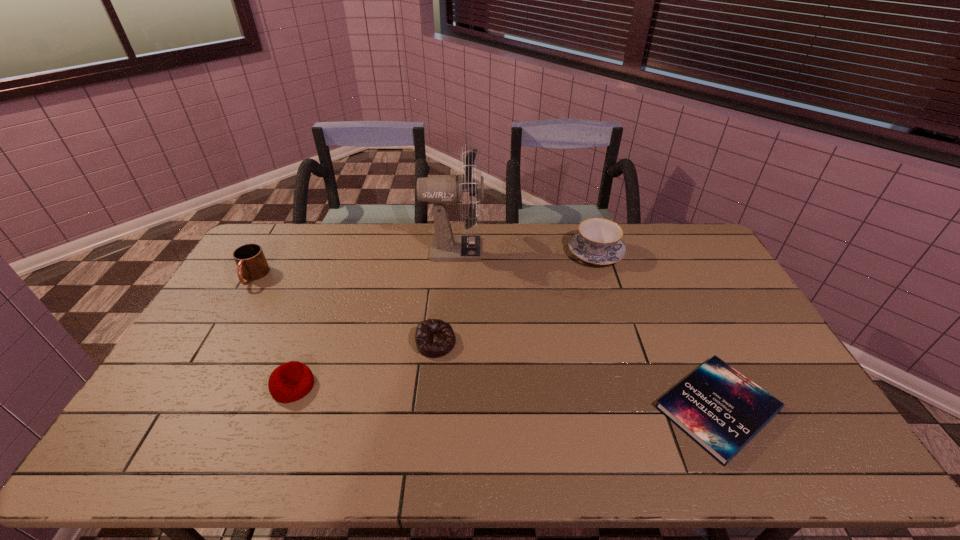
Image resolution: width=960 pixels, height=540 pixels. Find the location of `empty location between the tallest object and the leftmost object`. empty location between the tallest object and the leftmost object is located at coordinates (353, 263).

Find the location of a particular element. The height and width of the screenshot is (540, 960). free area in between the mug and the second shortest object is located at coordinates (345, 310).

You are a GUI agent. You are given a task and a screenshot of the screen. Output one action in this format:
    pyautogui.click(x=<x>, y=<y>)
    Task: Click on the free spot between the chinaware and the tallest object
    The width and height of the screenshot is (960, 540).
    Given the screenshot: What is the action you would take?
    pyautogui.click(x=525, y=251)

Locate an element on the screen. free space between the chinaware and the fifth object from right to left is located at coordinates (444, 319).

The width and height of the screenshot is (960, 540). Find the location of `free space between the fan and the fourth farthest object`. free space between the fan and the fourth farthest object is located at coordinates (444, 296).

Where is `vacant point located between the second object from left to right and the mug`? vacant point located between the second object from left to right and the mug is located at coordinates (274, 332).

Identify the location of object that is the fifth closest to the tallest object. (718, 407).

Identify which object is the fourth closest to the chinaware. Please provide its 2D coordinates. Your answer should be formatted as a tuple, i.e. [(x, y)], where the tuple contains the x and y coordinates of a point satisfying the conditions above.

[(291, 381)]

Identify the location of free spot that satisfies the following two spatial constraints: 1. on the seat area of the shortest object; 2. on the right side of the left beanbag. (285, 408).

I want to click on vacant space that satisfies the following two spatial constraints: 1. on the side of the shorter beanbag with the handle; 2. on the right side of the mug, so click(x=214, y=343).